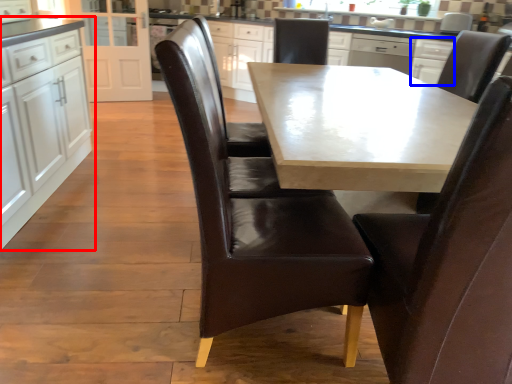
Question: Which object appears farthest to the camera in this image, cabinetry (highlighted by a red box) or cabinetry (highlighted by a blue box)?

Choices:
 (A) cabinetry
 (B) cabinetry

Answer: (B)